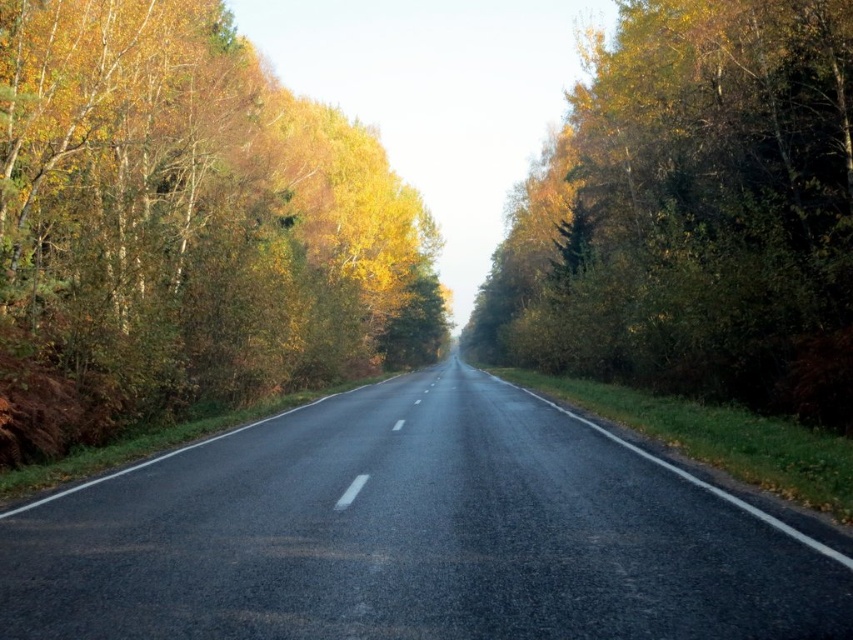
Question: Among these objects, which one is nearest to the camera?

Choices:
 (A) yellow-green leaves at left
 (B) green leafy tree at right

Answer: (A)

Question: Estimate the real-world distances between objects in this image. Which object is closer to the green leafy tree at right?

Choices:
 (A) yellow-green leaves at left
 (B) black asphalt highway at center

Answer: (A)

Question: Can you confirm if yellow-green leaves at left is positioned to the right of green leafy tree at right?

Choices:
 (A) no
 (B) yes

Answer: (A)

Question: Where is black asphalt highway at center located in relation to yellow-green leaves at left in the image?

Choices:
 (A) above
 (B) below

Answer: (B)

Question: Does yellow-green leaves at left come behind green leafy tree at right?

Choices:
 (A) yes
 (B) no

Answer: (B)

Question: Which of these objects is positioned closest to the black asphalt highway at center?

Choices:
 (A) yellow-green leaves at left
 (B) green leafy tree at right

Answer: (A)